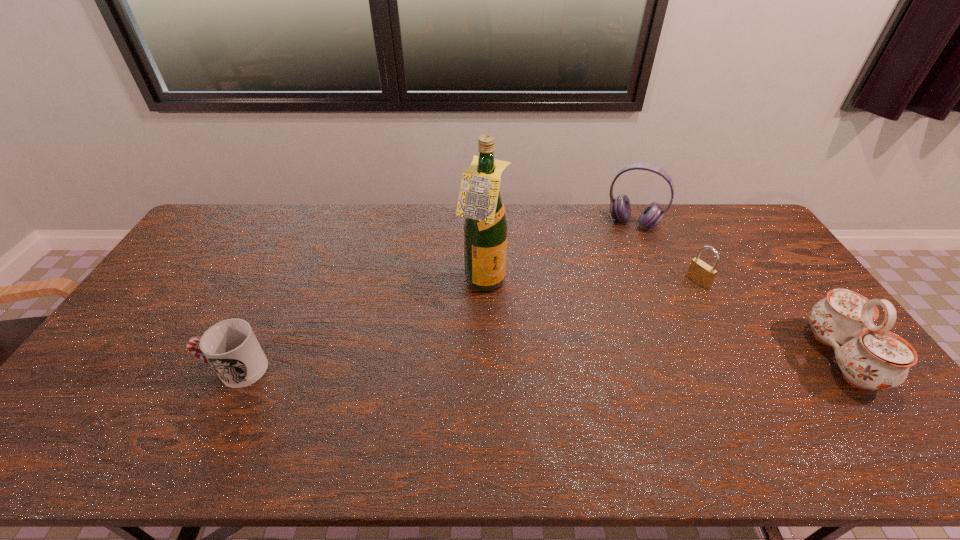
Identify the location of free space between the padlock and the farthest object. The height and width of the screenshot is (540, 960). (665, 252).

Find the location of a particular element. object that stands as the second closest to the tallest object is located at coordinates (230, 346).

Identify which object is the third closest to the tallest object. Please provide its 2D coordinates. Your answer should be formatted as a tuple, i.e. [(x, y)], where the tuple contains the x and y coordinates of a point satisfying the conditions above.

[(701, 273)]

Where is `free space that satisfies the following two spatial constraints: 1. on the back side of the headset; 2. on the left side of the tallest object`? The width and height of the screenshot is (960, 540). free space that satisfies the following two spatial constraints: 1. on the back side of the headset; 2. on the left side of the tallest object is located at coordinates (482, 222).

This screenshot has width=960, height=540. I want to click on free location that satisfies the following two spatial constraints: 1. on the back side of the padlock; 2. on the left side of the tallest object, so click(x=483, y=281).

I want to click on vacant region that satisfies the following two spatial constraints: 1. on the front side of the headset; 2. by the handle of the rightmost object, so click(690, 357).

You are a GUI agent. You are given a task and a screenshot of the screen. Output one action in this format:
    pyautogui.click(x=<x>, y=<y>)
    Task: Click on the free point that satisfies the following two spatial constraints: 1. on the front side of the rightmost object; 2. by the handle of the fourth object from right to left
    
    Given the screenshot: What is the action you would take?
    pyautogui.click(x=483, y=357)

I want to click on free space that satisfies the following two spatial constraints: 1. on the back side of the liquor; 2. on the left side of the padlock, so click(483, 281).

The width and height of the screenshot is (960, 540). I want to click on free space that satisfies the following two spatial constraints: 1. on the front side of the headset; 2. by the handle of the chinaware, so click(x=690, y=357).